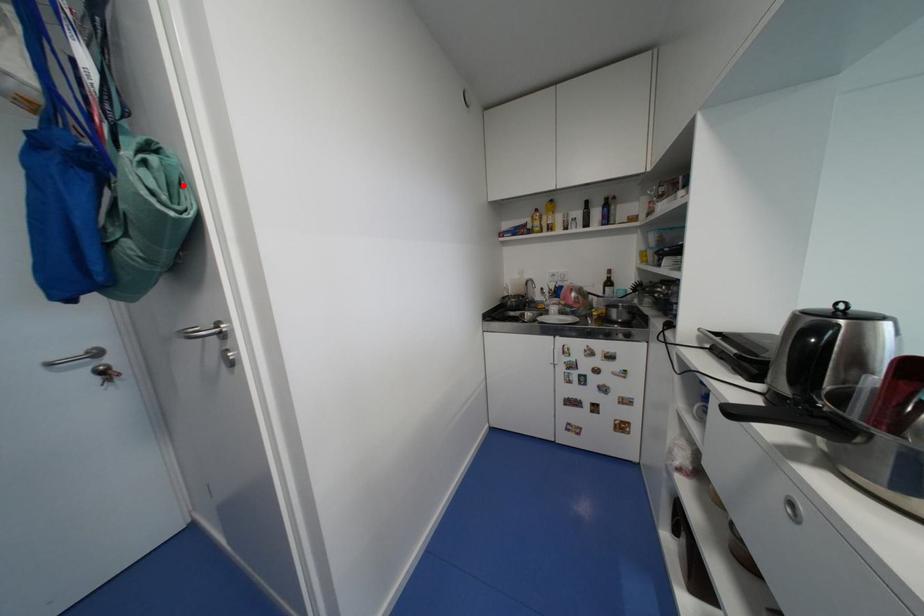
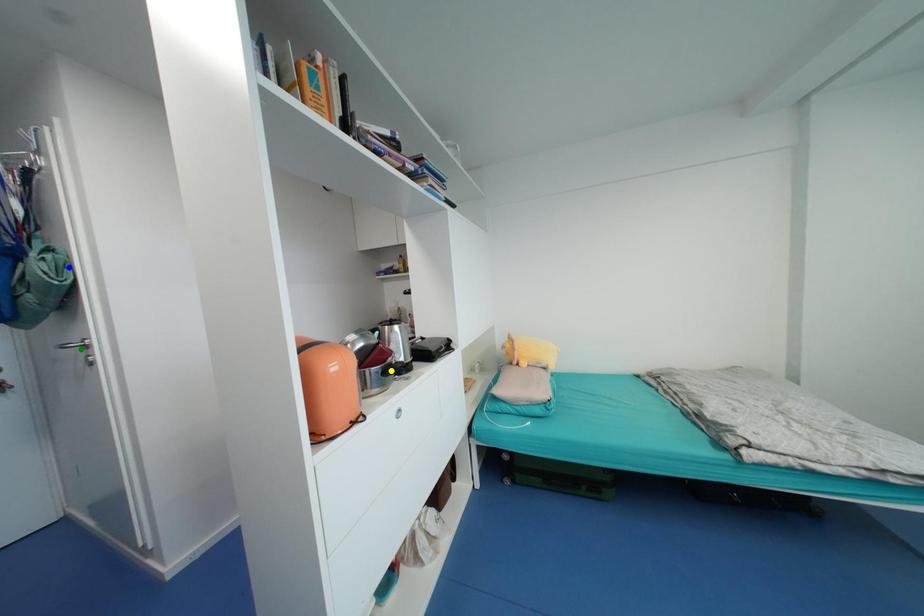
Question: I am providing you with two images of the same scene from different viewpoints. A red point is marked on the first image. You are given multiple points on the second image. Which mark in image 2 goes with the point in image 1?

Choices:
 (A) green point
 (B) blue point
 (C) yellow point

Answer: (B)